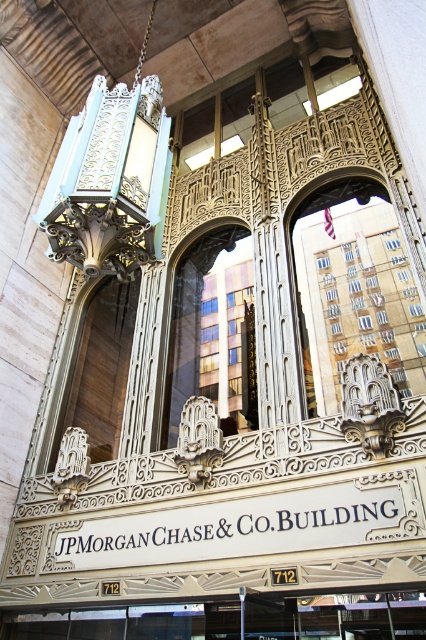
Does point (400, 252) lie in front of point (94, 328)?

Yes, point (400, 252) is closer to viewer.

Is gold ornate arch at center further to camera compared to wooden at center?

No, gold ornate arch at center is in front of wooden at center.

At what (x,y) coordinates should I click in order to perform the action: click on gold ornate arch at center. Please return your answer as a coordinate pair (x, y). The image size is (426, 640). Looking at the image, I should click on (357, 294).

Find the location of a particular element. The height and width of the screenshot is (640, 426). gold ornate arch at center is located at coordinates (357, 294).

Can you confirm if wooden at center is wider than gold ornate frame at center?

Incorrect, wooden at center's width does not surpass gold ornate frame at center's.

This screenshot has height=640, width=426. Identify the location of wooden at center. (94, 371).

Which is in front, point (414, 308) or point (170, 396)?

Point (414, 308)

In order to click on gold ornate arch at center in this screenshot , I will do `click(357, 294)`.

Locate an element on the screen. The height and width of the screenshot is (640, 426). gold ornate arch at center is located at coordinates (357, 294).

Where is `gold ornate arch at center`? gold ornate arch at center is located at coordinates (357, 294).